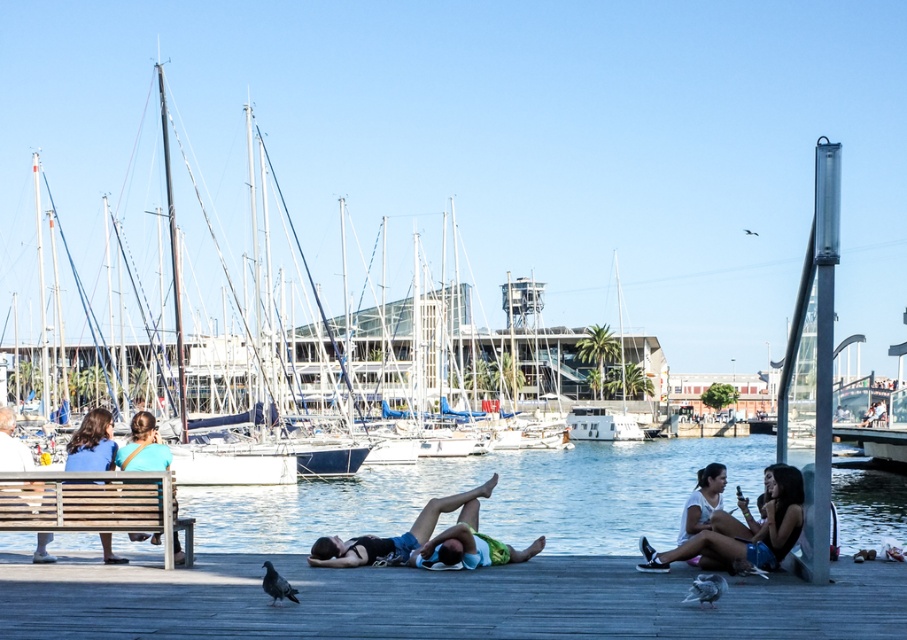
Question: Can you confirm if white cotton shirt at lower right is positioned to the right of blue denim jeans at left?

Choices:
 (A) no
 (B) yes

Answer: (B)

Question: Can you confirm if white sailboat at left is bigger than green fabric shorts at center?

Choices:
 (A) yes
 (B) no

Answer: (A)

Question: Does wooden bench at left appear on the left side of white cotton shirt at lower right?

Choices:
 (A) yes
 (B) no

Answer: (A)

Question: Estimate the real-world distances between objects in this image. Which object is farther from the white cotton dress at lower right?

Choices:
 (A) green fabric shorts at center
 (B) white sailboat at left
 (C) wooden bench at left

Answer: (B)

Question: Among these objects, which one is farthest from the camera?

Choices:
 (A) white cotton dress at lower right
 (B) wooden dock at lower center
 (C) matte blue shirt at left

Answer: (A)

Question: Which point is closer to the camera taking this photo?

Choices:
 (A) (24, 451)
 (B) (688, 499)
 (C) (161, 442)

Answer: (A)